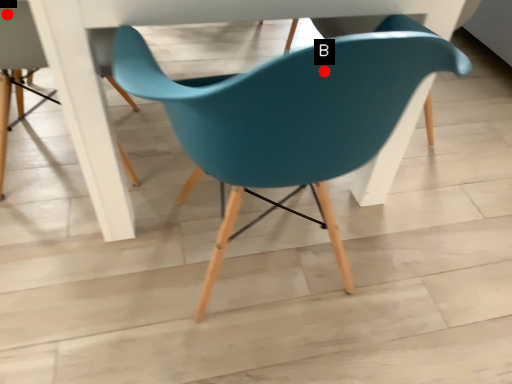
Question: Two points are circled on the image, labeled by A and B beside each circle. Among these points, which one is farthest from the camera?

Choices:
 (A) A is further
 (B) B is further

Answer: (A)